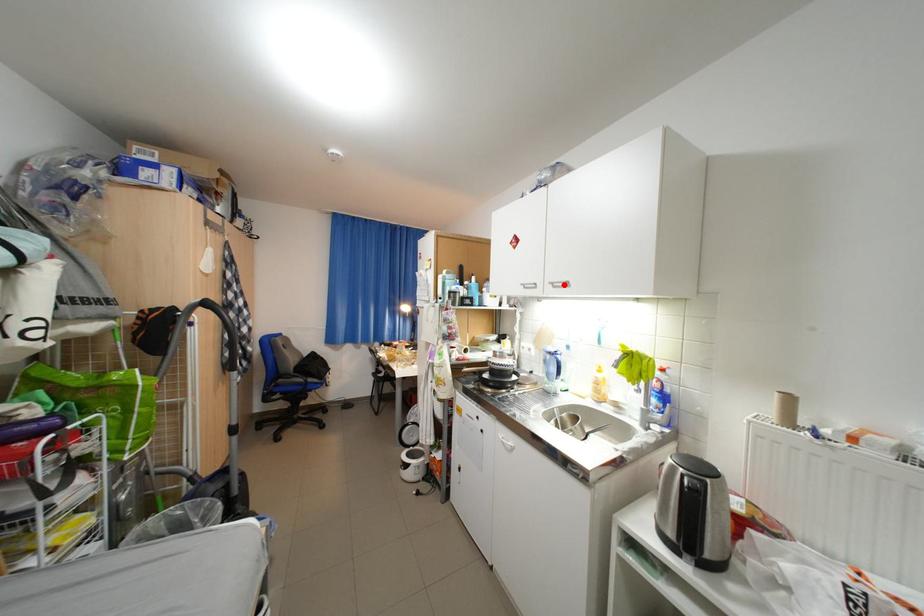
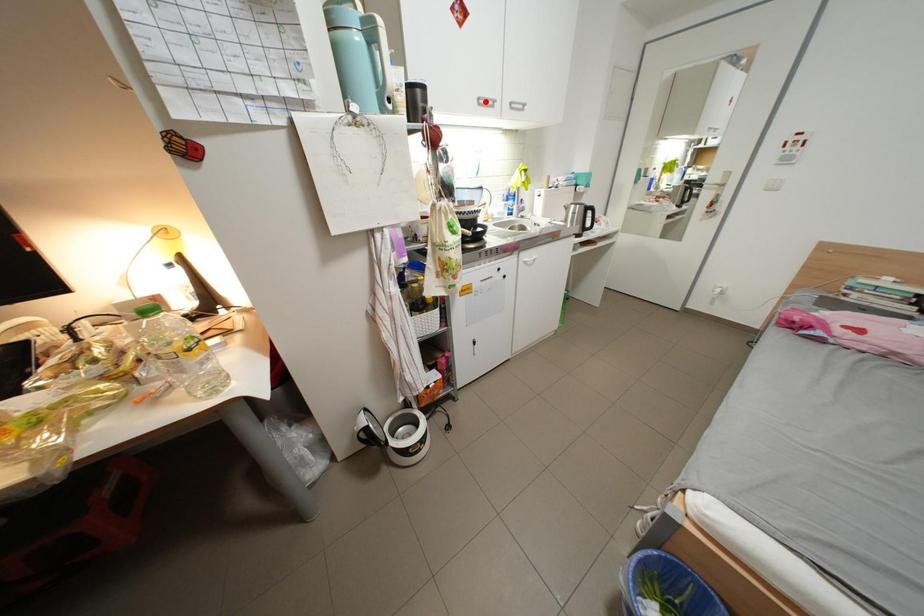
In the scene shown: I am providing you with two images of the same scene from different viewpoints. A red point is marked on the first image and another point is marked on the second image. Is the marked point in image1 the same physical position as the marked point in image2?

No